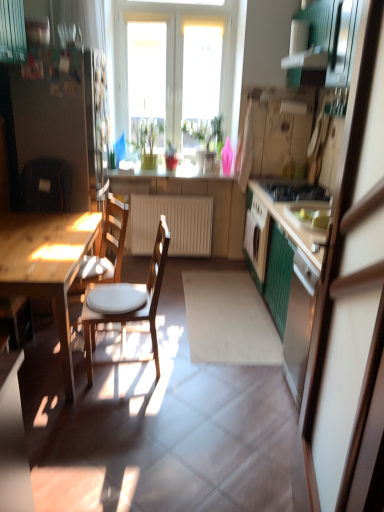
Question: Is wooden chair with white cushion at left, placed as the 2th chair when sorted from back to front, wider than white glossy exhaust hood at upper center?

Choices:
 (A) no
 (B) yes

Answer: (B)

Question: Does wooden chair with white cushion at left, placed as the 2th chair when sorted from back to front, touch white glossy exhaust hood at upper center?

Choices:
 (A) yes
 (B) no

Answer: (B)

Question: Are wooden chair with white cushion at left, placed as the 2th chair when sorted from back to front, and white glossy exhaust hood at upper center far apart?

Choices:
 (A) yes
 (B) no

Answer: (A)

Question: From a real-world perspective, is wooden chair with white cushion at left, placed as the 2th chair when sorted from back to front, physically above white glossy exhaust hood at upper center?

Choices:
 (A) yes
 (B) no

Answer: (B)

Question: From the image's perspective, is wooden chair with white cushion at left, acting as the first chair starting from the front, beneath white glossy exhaust hood at upper center?

Choices:
 (A) yes
 (B) no

Answer: (A)

Question: Is wooden chair with white cushion at left, acting as the first chair starting from the front, facing towards white glossy exhaust hood at upper center?

Choices:
 (A) yes
 (B) no

Answer: (B)

Question: Are green matte cabinet at right and white glossy exhaust hood at upper center far apart?

Choices:
 (A) no
 (B) yes

Answer: (B)

Question: Is green matte cabinet at right positioned behind white glossy exhaust hood at upper center?

Choices:
 (A) yes
 (B) no

Answer: (B)

Question: Is green matte cabinet at right in contact with white glossy exhaust hood at upper center?

Choices:
 (A) yes
 (B) no

Answer: (B)

Question: Considering the relative sizes of green matte cabinet at right and white glossy exhaust hood at upper center in the image provided, is green matte cabinet at right wider than white glossy exhaust hood at upper center?

Choices:
 (A) no
 (B) yes

Answer: (A)

Question: Can you confirm if green matte cabinet at right is smaller than white glossy exhaust hood at upper center?

Choices:
 (A) yes
 (B) no

Answer: (B)

Question: Is green matte cabinet at right shorter than white glossy exhaust hood at upper center?

Choices:
 (A) yes
 (B) no

Answer: (B)

Question: Is the position of green glossy plant at center, which is the first houseplant from left to right, more distant than that of green wood cabinet at right?

Choices:
 (A) yes
 (B) no

Answer: (A)